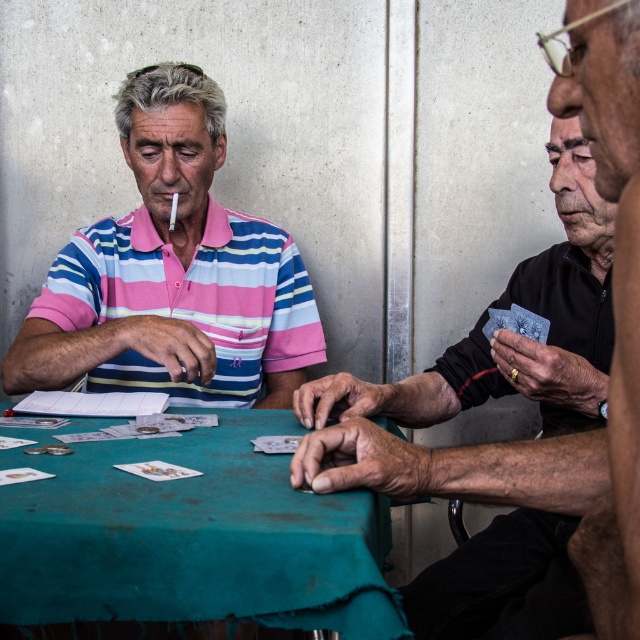
You are a photographer trying to capture a closeup of the matte black shirt at right and the black matte card at right. If you want to ensure both are in focus, which one should you adjust your camera focus to prioritize based on their sizes?

The matte black shirt at right is wider than the black matte card at right, so you should prioritize focusing on the matte black shirt at right since it is larger and might require more precise focus to capture details.

You are a photographer trying to capture a closeup of the matte black shirt at right and the black matte card at right. Which object should you zoom in on first to ensure it fits entirely within the frame?

The matte black shirt at right is bigger than the black matte card at right, so you should zoom in on the matte black shirt at right first to ensure it fits entirely within the frame before adjusting for the smaller card.